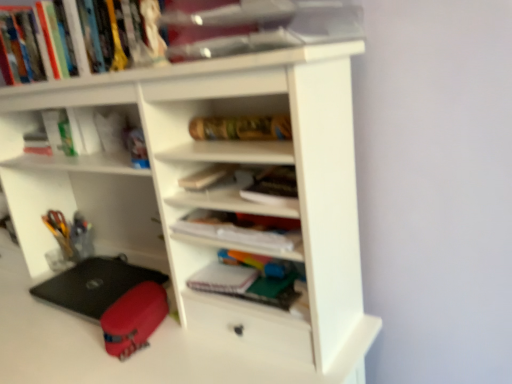
Question: From the image's perspective, would you say white matte notebook at center, the first book ordered from the bottom, is shown under black matte laptop at lower left?

Choices:
 (A) yes
 (B) no

Answer: (B)

Question: Does white matte notebook at center, the first book ordered from the bottom, have a smaller size compared to black matte laptop at lower left?

Choices:
 (A) yes
 (B) no

Answer: (A)

Question: Is white matte notebook at center, the first book ordered from the bottom, positioned before black matte laptop at lower left?

Choices:
 (A) no
 (B) yes

Answer: (B)

Question: Is white matte notebook at center, placed as the sixth book when sorted from top to bottom, looking in the opposite direction of black matte laptop at lower left?

Choices:
 (A) yes
 (B) no

Answer: (B)

Question: Does white matte notebook at center, the first book ordered from the bottom, have a lesser height compared to black matte laptop at lower left?

Choices:
 (A) yes
 (B) no

Answer: (A)

Question: From the image's perspective, is white matte notebook at center, placed as the sixth book when sorted from top to bottom, above black matte laptop at lower left?

Choices:
 (A) no
 (B) yes

Answer: (B)

Question: Is hardcover book at center, which is the fourth book from top to bottom, placed right next to matte white book at center, the fourth book ordered from the bottom?

Choices:
 (A) yes
 (B) no

Answer: (B)

Question: From the image's perspective, is hardcover book at center, which is the fourth book from top to bottom, on top of matte white book at center, the third book positioned from the top?

Choices:
 (A) no
 (B) yes

Answer: (A)

Question: Does hardcover book at center, the third book in the bottom-to-top sequence, have a greater width compared to matte white book at center, the third book positioned from the top?

Choices:
 (A) no
 (B) yes

Answer: (A)

Question: Considering the relative sizes of hardcover book at center, which is the fourth book from top to bottom, and matte white book at center, the third book positioned from the top, in the image provided, is hardcover book at center, which is the fourth book from top to bottom, shorter than matte white book at center, the third book positioned from the top,?

Choices:
 (A) yes
 (B) no

Answer: (A)

Question: From the image's perspective, would you say hardcover book at center, which is the fourth book from top to bottom, is shown under matte white book at center, the fourth book ordered from the bottom?

Choices:
 (A) no
 (B) yes

Answer: (B)

Question: Is hardcover book at center, which is the fourth book from top to bottom, oriented towards matte white book at center, the fourth book ordered from the bottom?

Choices:
 (A) no
 (B) yes

Answer: (A)

Question: From the image's perspective, is black matte laptop at lower left located beneath wooden textured book at center, which is counted as the fifth book, starting from the bottom?

Choices:
 (A) yes
 (B) no

Answer: (A)